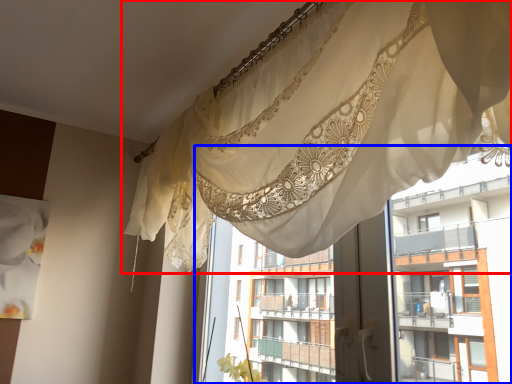
Question: Which object is further to the camera taking this photo, curtain (highlighted by a red box) or residence (highlighted by a blue box)?

Choices:
 (A) curtain
 (B) residence

Answer: (B)